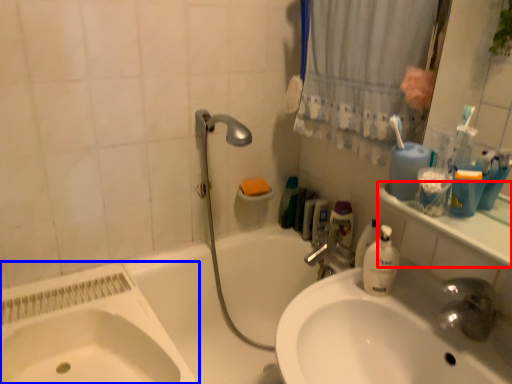
Question: Which object appears closest to the camera in this image, counter top (highlighted by a red box) or sink (highlighted by a blue box)?

Choices:
 (A) counter top
 (B) sink

Answer: (A)